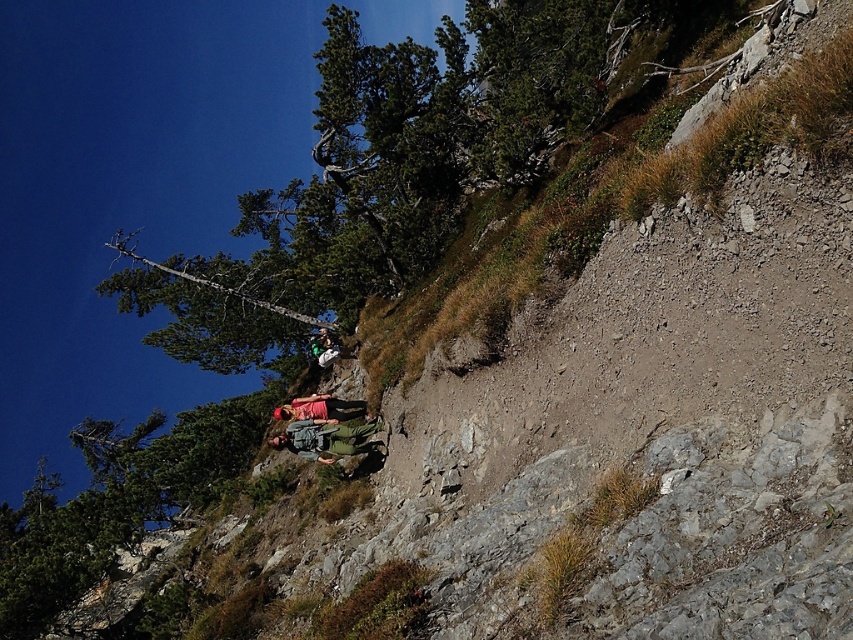
Can you confirm if green canvas backpack at center is wider than green fabric backpack at center?

In fact, green canvas backpack at center might be narrower than green fabric backpack at center.

Is green canvas backpack at center above green fabric backpack at center?

Actually, green canvas backpack at center is below green fabric backpack at center.

Is point (299, 445) closer to viewer compared to point (323, 356)?

Yes, it is.

The height and width of the screenshot is (640, 853). What are the coordinates of `green canvas backpack at center` in the screenshot? It's located at (326, 438).

Does point (364, 451) come behind point (306, 396)?

No, (364, 451) is in front of (306, 396).

Who is lower down, green canvas backpack at center or matte pink shirt at center?

matte pink shirt at center is below.

Describe the element at coordinates (326, 438) in the screenshot. I see `green canvas backpack at center` at that location.

Identify the location of green canvas backpack at center. (326, 438).

Who is positioned more to the right, matte pink shirt at center or green fabric backpack at center?

Positioned to the right is green fabric backpack at center.

Based on the photo, is matte pink shirt at center closer to camera compared to green fabric backpack at center?

Yes, matte pink shirt at center is closer to the viewer.

Is point (302, 419) farther from camera compared to point (314, 348)?

No, it is not.

Locate an element on the screen. The width and height of the screenshot is (853, 640). matte pink shirt at center is located at coordinates (320, 408).